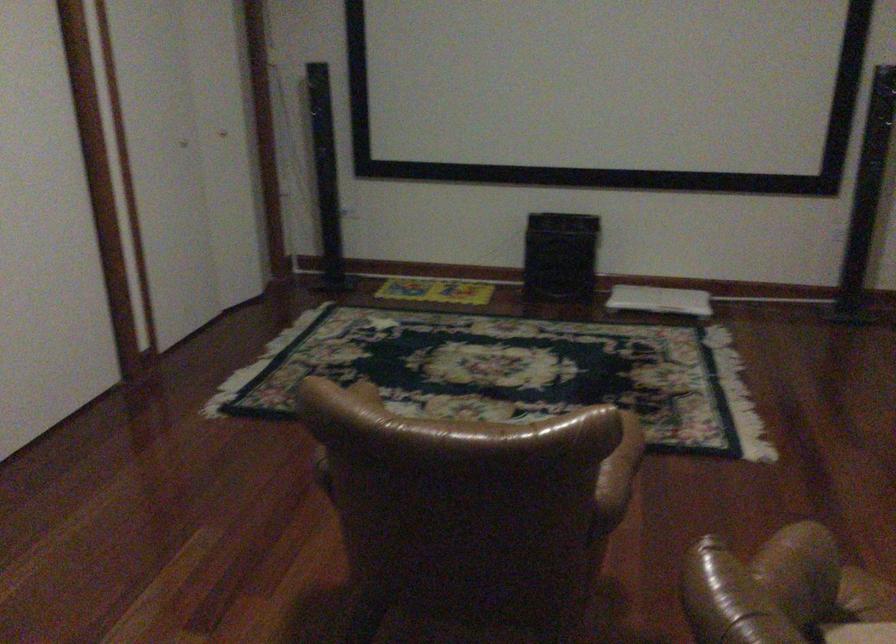
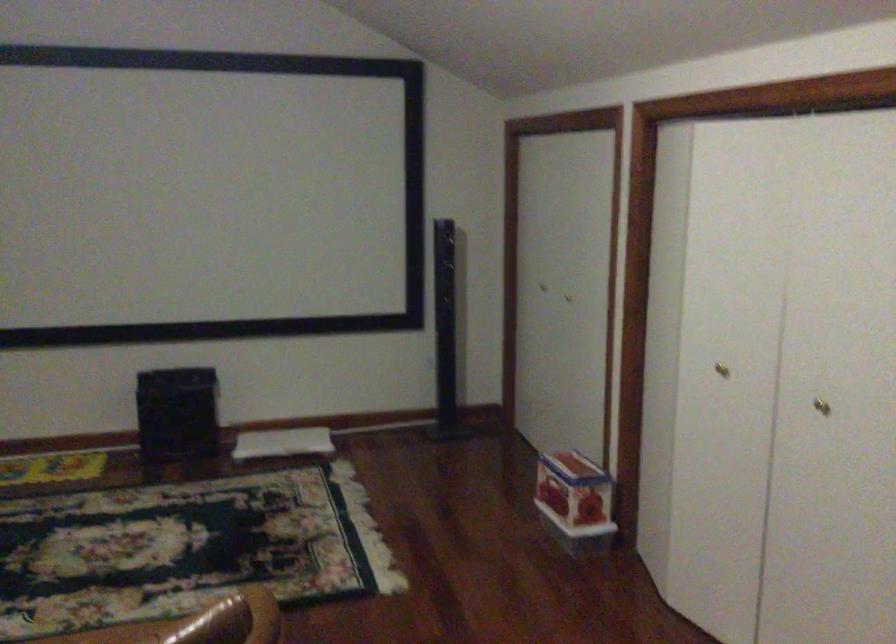
Question: How did the camera likely rotate?

Choices:
 (A) Left
 (B) Right
 (C) Up
 (D) Down

Answer: (B)